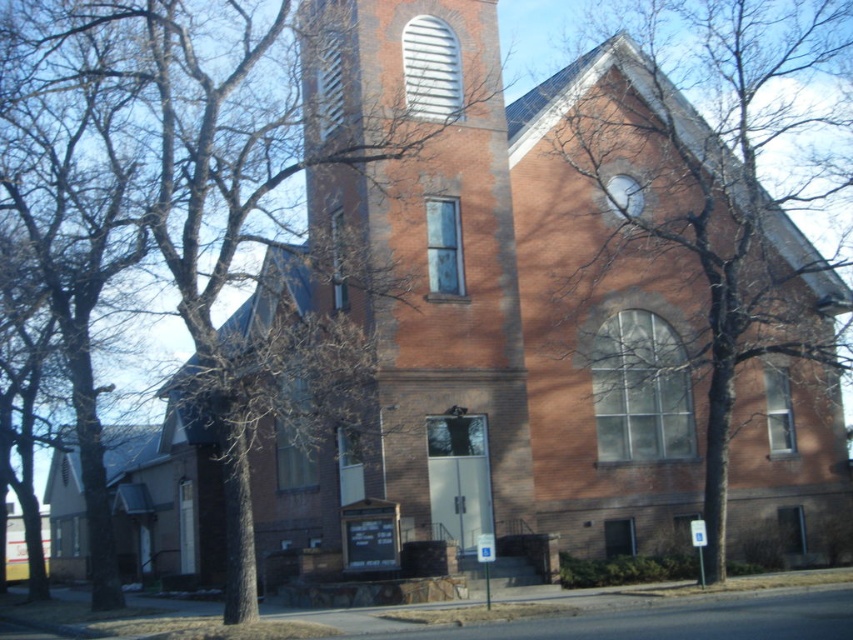
You are a visitor to the church and want to take a photo that includes both the brown bark tree at upper left and the brown bark tree at right. Which tree should you position closer to the camera to ensure both are fully visible in the frame?

To ensure both the brown bark tree at upper left and the brown bark tree at right are fully visible in the frame, you should position the brown bark tree at upper left closer to the camera since it is smaller and might be farther away, requiring it to be nearer to appear adequately sized in the photo.